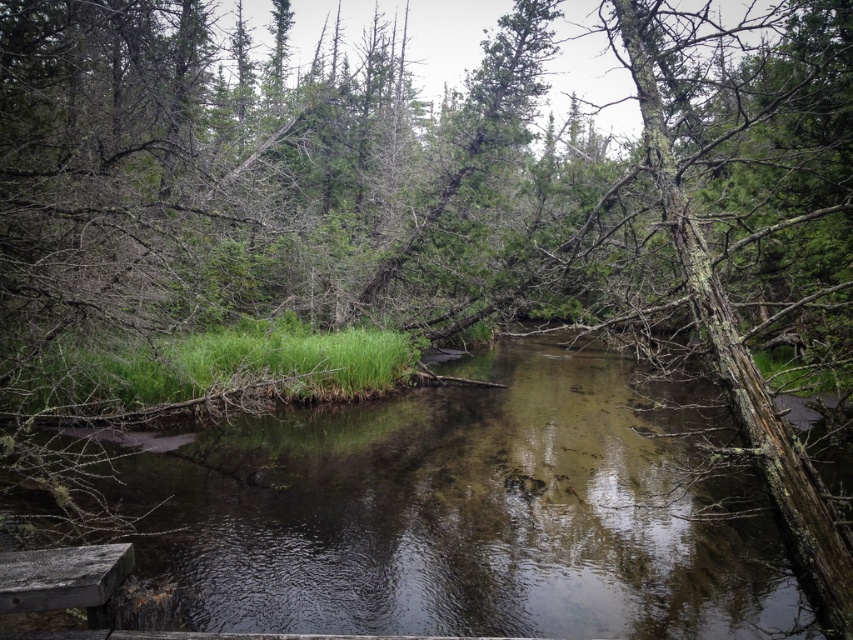
Question: Which of the following is the closest to the observer?

Choices:
 (A) (22, 593)
 (B) (428, 460)

Answer: (A)

Question: Can you confirm if green grassy river at center is wider than rusty wooden plank at lower left?

Choices:
 (A) yes
 (B) no

Answer: (A)

Question: Is green grassy river at center behind rusty wooden plank at lower left?

Choices:
 (A) no
 (B) yes

Answer: (B)

Question: Is green grassy river at center further to camera compared to rusty wooden plank at lower left?

Choices:
 (A) yes
 (B) no

Answer: (A)

Question: Which point is farther from the camera taking this photo?

Choices:
 (A) (26, 563)
 (B) (329, 541)

Answer: (B)